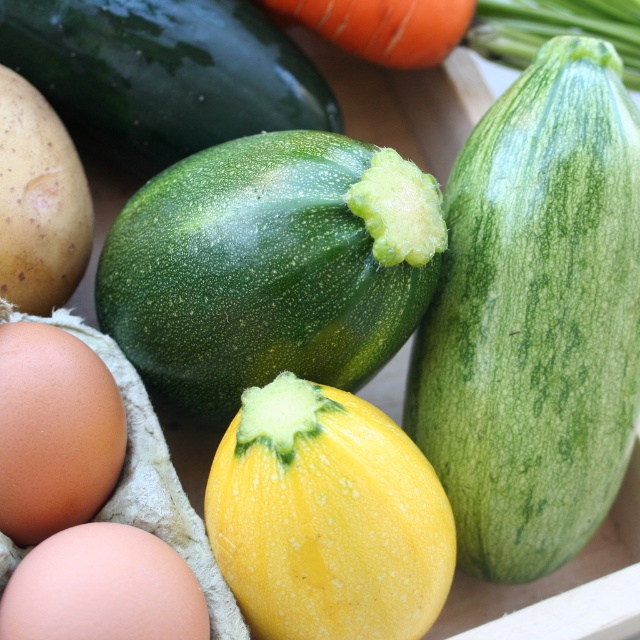
You are a customer at the market and want to pick up the orange smooth carrot at upper center. Which direction should you move your hand from the brown matte egg at lower left to reach it?

To reach the orange smooth carrot at upper center from the brown matte egg at lower left, you should move your hand to the right and upward since the orange smooth carrot at upper center is positioned to the right and above the brown matte egg at lower left.

Where is the green striped squash at center located in the image?

The green striped squash at center is located at point (536, 316) in the image.